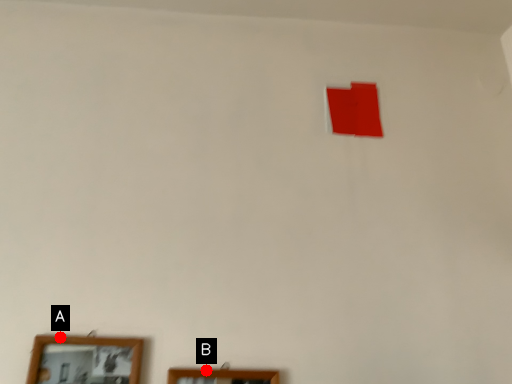
Question: Two points are circled on the image, labeled by A and B beside each circle. Among these points, which one is farthest from the camera?

Choices:
 (A) A is further
 (B) B is further

Answer: (A)